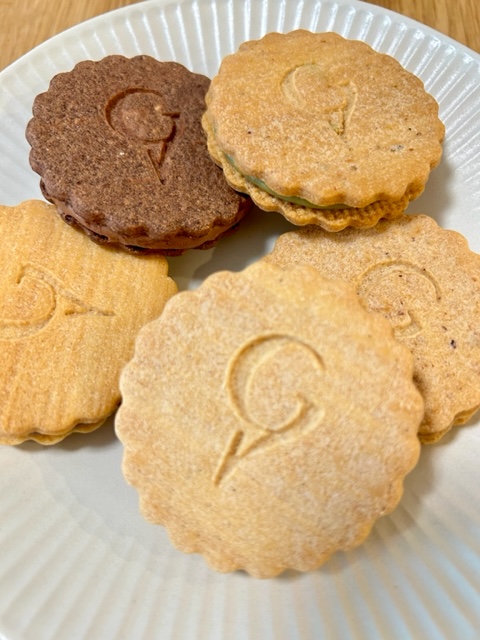
Identify the location of wooden table. (58, 11).